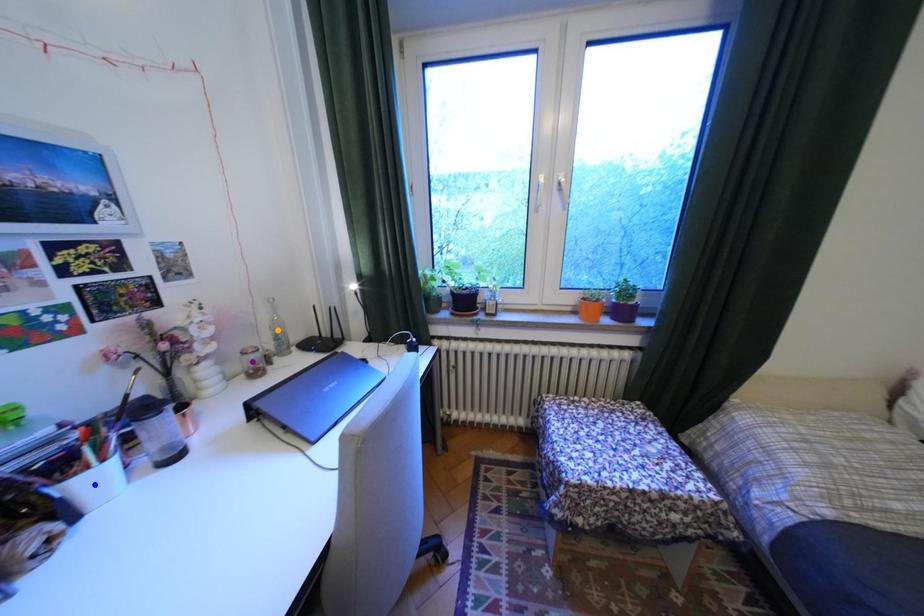
Order these from nearest to farthest:
blue point
orange point
purple point

blue point < purple point < orange point